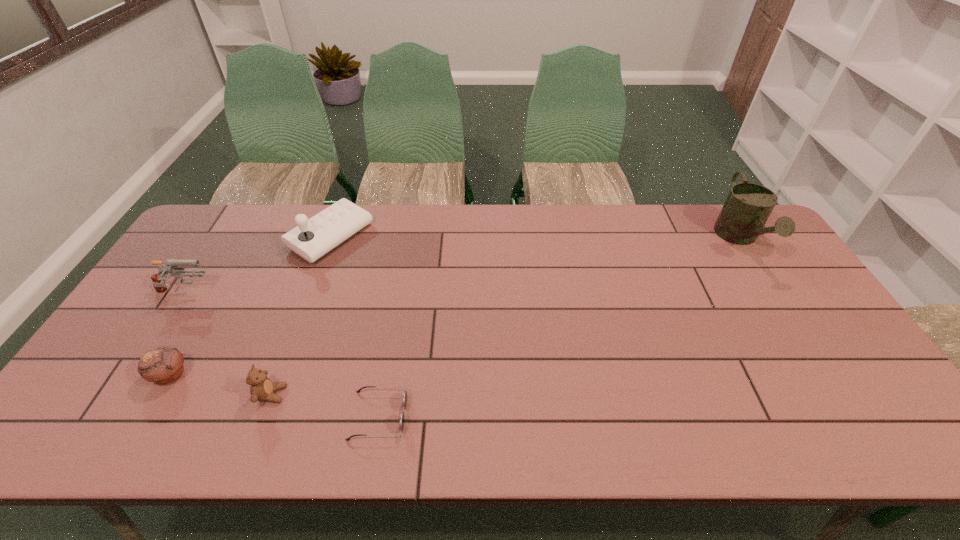
Where is `free space located on the right of the joystick`? free space located on the right of the joystick is located at coordinates (464, 237).

The height and width of the screenshot is (540, 960). Find the location of `free space located at the barrel end of the third farthest object`. free space located at the barrel end of the third farthest object is located at coordinates (277, 294).

In order to click on vacant space located on the front-facing side of the third shortest object in this screenshot , I will do `click(435, 394)`.

Locate an element on the screen. The image size is (960, 540). vacant region located on the right of the second shortest object is located at coordinates (342, 375).

Locate an element on the screen. This screenshot has height=540, width=960. vacant space located on the front-facing side of the shortest object is located at coordinates (471, 416).

This screenshot has height=540, width=960. Identify the location of watering can that is at the far edge. (748, 206).

I want to click on joystick that is at the far edge, so click(x=312, y=238).

This screenshot has width=960, height=540. I want to click on object situated at the near edge, so click(402, 416).

The width and height of the screenshot is (960, 540). Find the location of `gun at the left edge`. gun at the left edge is located at coordinates [x=158, y=280].

Locate an element on the screen. muffin located at the left edge is located at coordinates (163, 365).